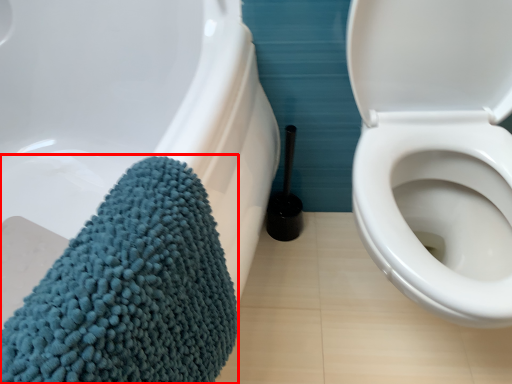
Question: In this image, where is bath towel (annotated by the red box) located relative to brush?

Choices:
 (A) right
 (B) left

Answer: (B)